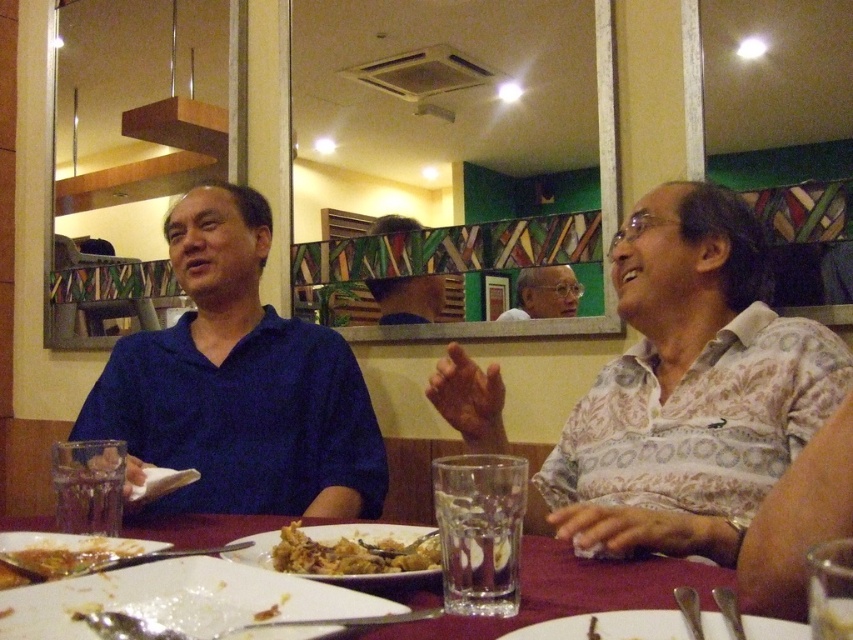
Question: Which of the following is the farthest from the observer?

Choices:
 (A) golden crispy fried rice at lower center
 (B) white glossy plate at center
 (C) marble table at center

Answer: (A)

Question: Based on their relative distances, which object is nearer to the blue matte shirt at left?

Choices:
 (A) white glossy plate at center
 (B) white floral shirt at right
 (C) matte white shirt at center
 (D) golden crispy fried rice at lower center

Answer: (C)

Question: Among these objects, which one is farthest from the camera?

Choices:
 (A) brown crispy fried food at lower left
 (B) matte white shirt at center
 (C) blue matte shirt at left

Answer: (B)

Question: Does white floral shirt at right appear on the right side of marble table at center?

Choices:
 (A) yes
 (B) no

Answer: (A)

Question: Is golden crispy fried rice at lower center positioned at the back of brown crispy fried food at lower left?

Choices:
 (A) yes
 (B) no

Answer: (A)

Question: From the image, what is the correct spatial relationship of brown crispy fried food at lower left in relation to matte white shirt at center?

Choices:
 (A) left
 (B) right

Answer: (A)